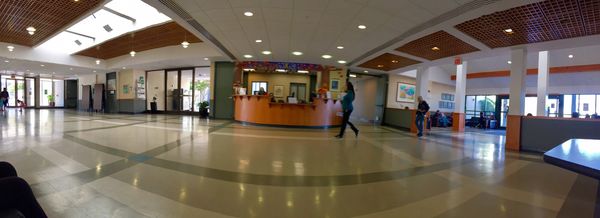
Where is `hallway`? hallway is located at coordinates (357, 102).